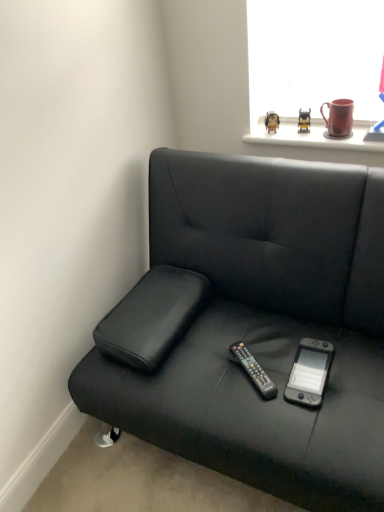
Locate an element on the screen. This screenshot has width=384, height=512. gray matte nintendo switch at center is located at coordinates (309, 373).

Find the location of a particular element. matte black figurine at upper center, the first toy from the right is located at coordinates (304, 121).

What is the approximate height of matte black figurine at upper center, which appears as the second toy when viewed from the right?

The height of matte black figurine at upper center, which appears as the second toy when viewed from the right, is 3.29 inches.

Where is `black plastic remote at center`? The width and height of the screenshot is (384, 512). black plastic remote at center is located at coordinates (254, 370).

Where is `black leather studio couch at lower left`? This screenshot has width=384, height=512. black leather studio couch at lower left is located at coordinates (253, 325).

Could you tell me if matte black figurine at upper center, the first toy from the right, is facing black leather studio couch at lower left?

Yes, matte black figurine at upper center, the first toy from the right, faces towards black leather studio couch at lower left.

Where is `toy that is the 2nd object above the black leather studio couch at lower left (from a real-world perspective)`? toy that is the 2nd object above the black leather studio couch at lower left (from a real-world perspective) is located at coordinates [304, 121].

Consider the image. Measure the distance from matte black figurine at upper center, the first toy from the right, to black leather studio couch at lower left.

They are 31.28 inches apart.

Looking at this image, is matte black figurine at upper center, marked as the 2th toy in a left-to-right arrangement, wider or thinner than black leather studio couch at lower left?

Considering their sizes, matte black figurine at upper center, marked as the 2th toy in a left-to-right arrangement, looks slimmer than black leather studio couch at lower left.

Is matte red mug at upper right aimed at matte black figurine at upper center, the first toy from the right?

No, matte red mug at upper right is not facing towards matte black figurine at upper center, the first toy from the right.

In the image, is matte red mug at upper right positioned in front of or behind matte black figurine at upper center, the first toy from the right?

matte red mug at upper right is in front of matte black figurine at upper center, the first toy from the right.

From a real-world perspective, is matte red mug at upper right under matte black figurine at upper center, the first toy from the right?

No, from a real-world perspective, matte red mug at upper right is not under matte black figurine at upper center, the first toy from the right.

Is point (309, 349) positioned in front of point (339, 132)?

Yes, it is.

From a real-world perspective, between gray matte nintendo switch at center and matte red mug at upper right, who is vertically lower?

In real-world perspective, gray matte nintendo switch at center is lower.

From the image's perspective, is gray matte nintendo switch at center located above or below matte red mug at upper right?

From the image's perspective, gray matte nintendo switch at center appears below matte red mug at upper right.

From a real-world perspective, who is located lower, matte red mug at upper right or black leather studio couch at lower left?

black leather studio couch at lower left.

Would you say matte red mug at upper right is a long distance from black leather studio couch at lower left?

No.

Who is bigger, matte red mug at upper right or black leather studio couch at lower left?

black leather studio couch at lower left.

Which object is wider, matte red mug at upper right or black leather studio couch at lower left?

Wider between the two is black leather studio couch at lower left.

Looking at this image, considering the relative positions of black leather studio couch at lower left and matte red mug at upper right in the image provided, is black leather studio couch at lower left to the left of matte red mug at upper right from the viewer's perspective?

Correct, you'll find black leather studio couch at lower left to the left of matte red mug at upper right.

Based on their sizes in the image, would you say black leather studio couch at lower left is bigger or smaller than matte red mug at upper right?

Considering their sizes, black leather studio couch at lower left takes up more space than matte red mug at upper right.

Are black leather studio couch at lower left and matte red mug at upper right far apart?

No.

Does matte red mug at upper right turn towards matte black figurine at upper center, which appears as the second toy when viewed from the right?

No, matte red mug at upper right is not facing towards matte black figurine at upper center, which appears as the second toy when viewed from the right.

Is matte red mug at upper right located outside matte black figurine at upper center, positioned as the 1th toy in left-to-right order?

Absolutely, matte red mug at upper right is external to matte black figurine at upper center, positioned as the 1th toy in left-to-right order.

Looking at this image, which of these two, matte red mug at upper right or matte black figurine at upper center, positioned as the 1th toy in left-to-right order, is wider?

Wider between the two is matte red mug at upper right.

From the image's perspective, does matte red mug at upper right appear higher than matte black figurine at upper center, positioned as the 1th toy in left-to-right order?

Actually, matte red mug at upper right appears below matte black figurine at upper center, positioned as the 1th toy in left-to-right order, in the image.

In terms of height, does black plastic remote at center look taller or shorter compared to matte red mug at upper right?

Clearly, black plastic remote at center is shorter compared to matte red mug at upper right.

How many degrees apart are the facing directions of black plastic remote at center and matte red mug at upper right?

They differ by 42.6 degrees in their facing directions.

Which object is closer to the camera taking this photo, black plastic remote at center or matte red mug at upper right?

black plastic remote at center is in front.

Does point (244, 354) appear closer or farther from the camera than point (351, 134)?

Point (244, 354) is closer to the camera than point (351, 134).

Image resolution: width=384 pixels, height=512 pixels. What are the coordinates of `the 1st toy behind when counting from the black leather studio couch at lower left` in the screenshot? It's located at (304, 121).

At what (x,y) coordinates should I click in order to perform the action: click on mug in front of the matte black figurine at upper center, the first toy from the right. Please return your answer as a coordinate pair (x, y). Looking at the image, I should click on (339, 118).

Which object lies nearer to the anchor point black plastic remote at center, gray matte nintendo switch at center or matte black figurine at upper center, marked as the 2th toy in a left-to-right arrangement?

Based on the image, gray matte nintendo switch at center appears to be nearer to black plastic remote at center.

Consider the image. When comparing their distances from matte black figurine at upper center, which appears as the second toy when viewed from the right, does matte black figurine at upper center, marked as the 2th toy in a left-to-right arrangement, or black plastic remote at center seem closer?

matte black figurine at upper center, marked as the 2th toy in a left-to-right arrangement, is closer to matte black figurine at upper center, which appears as the second toy when viewed from the right.

When comparing their distances from matte black figurine at upper center, which appears as the second toy when viewed from the right, does matte red mug at upper right or black plastic remote at center seem further?

black plastic remote at center lies further to matte black figurine at upper center, which appears as the second toy when viewed from the right, than the other object.

Considering their positions, is matte black figurine at upper center, positioned as the 1th toy in left-to-right order, positioned further to matte red mug at upper right than gray matte nintendo switch at center?

gray matte nintendo switch at center is positioned further to the anchor matte red mug at upper right.

From the image, which object appears to be farther from matte black figurine at upper center, the first toy from the right, black leather studio couch at lower left or matte red mug at upper right?

black leather studio couch at lower left lies further to matte black figurine at upper center, the first toy from the right, than the other object.

Estimate the real-world distances between objects in this image. Which object is closer to black plastic remote at center, matte black figurine at upper center, which appears as the second toy when viewed from the right, or black leather studio couch at lower left?

Based on the image, black leather studio couch at lower left appears to be nearer to black plastic remote at center.

Based on their spatial positions, is matte black figurine at upper center, positioned as the 1th toy in left-to-right order, or black plastic remote at center further from black leather studio couch at lower left?

matte black figurine at upper center, positioned as the 1th toy in left-to-right order.

Considering their positions, is gray matte nintendo switch at center positioned closer to matte black figurine at upper center, marked as the 2th toy in a left-to-right arrangement, than black leather studio couch at lower left?

black leather studio couch at lower left.

The height and width of the screenshot is (512, 384). In order to click on mug located between black leather studio couch at lower left and matte black figurine at upper center, marked as the 2th toy in a left-to-right arrangement, in the depth direction in this screenshot , I will do `click(339, 118)`.

In order to click on studio couch that lies between matte red mug at upper right and black plastic remote at center from top to bottom in this screenshot , I will do `click(253, 325)`.

Where is `toy between matte black figurine at upper center, positioned as the 1th toy in left-to-right order, and matte red mug at upper right, in the horizontal direction`? Image resolution: width=384 pixels, height=512 pixels. toy between matte black figurine at upper center, positioned as the 1th toy in left-to-right order, and matte red mug at upper right, in the horizontal direction is located at coordinates (304, 121).

Find the location of a particular element. The width and height of the screenshot is (384, 512). mug between matte black figurine at upper center, positioned as the 1th toy in left-to-right order, and gray matte nintendo switch at center in the up-down direction is located at coordinates click(339, 118).